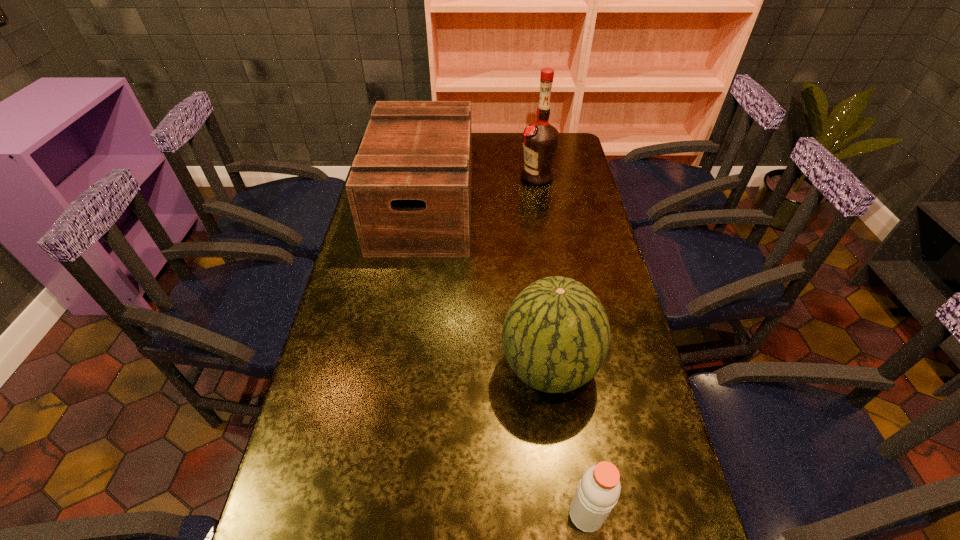
Identify the location of vacant space situated 0.150m on the left of the nearest object. (494, 514).

Locate an element on the screen. object located at the left edge is located at coordinates (409, 189).

Locate an element on the screen. Image resolution: width=960 pixels, height=540 pixels. liquor that is at the right edge is located at coordinates (540, 140).

Find the location of a particular element. The width and height of the screenshot is (960, 540). watermelon that is at the right edge is located at coordinates (556, 334).

The width and height of the screenshot is (960, 540). In the image, there is a desktop. Find the location of `vacant region at the left edge`. vacant region at the left edge is located at coordinates (316, 413).

You are a GUI agent. You are given a task and a screenshot of the screen. Output one action in this format:
    pyautogui.click(x=<x>, y=<y>)
    Task: Click on the free space at the right edge
    This screenshot has width=960, height=540.
    Given the screenshot: What is the action you would take?
    pyautogui.click(x=656, y=457)

Where is `free area in between the shortest object and the box`? The height and width of the screenshot is (540, 960). free area in between the shortest object and the box is located at coordinates (505, 360).

Where is `vacant region between the watermelon and the leftmost object`? This screenshot has height=540, width=960. vacant region between the watermelon and the leftmost object is located at coordinates (486, 287).

Image resolution: width=960 pixels, height=540 pixels. I want to click on free point between the leftmost object and the third farthest object, so pyautogui.click(x=486, y=287).

Identify the location of unoccupied area between the nearest object and the second nearest object. (567, 441).